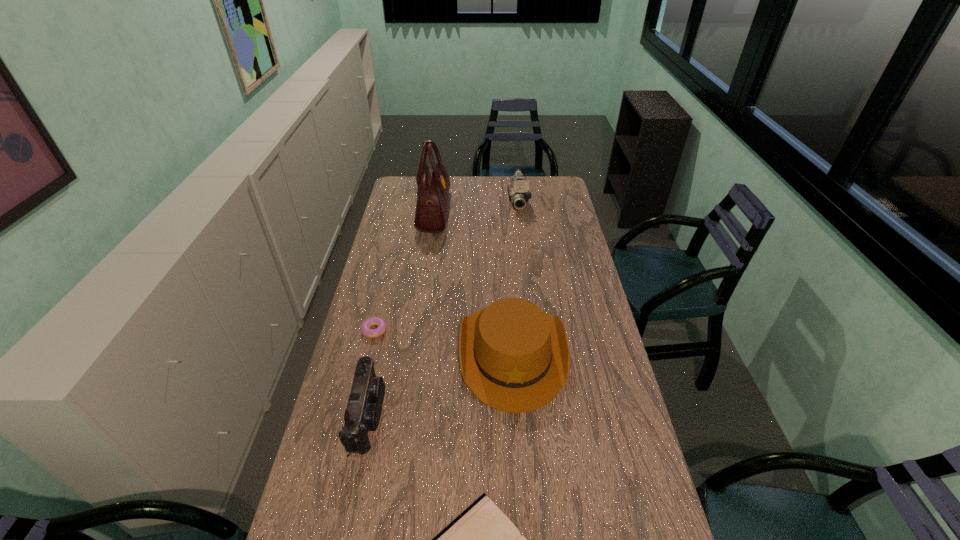
Identify which object is located as the fifth nearest to the nearer camcorder. Please provide its 2D coordinates. Your answer should be formatted as a tuple, i.e. [(x, y)], where the tuple contains the x and y coordinates of a point satisfying the conditions above.

[(518, 192)]

What are the coordinates of `object that is the fifth nearest to the handbag` in the screenshot? It's located at (482, 539).

Identify the location of free space that satisfies the following two spatial constraints: 1. on the front-facing side of the right camcorder; 2. on the front-facing side of the left camcorder. (546, 415).

The width and height of the screenshot is (960, 540). I want to click on vacant region that satisfies the following two spatial constraints: 1. on the front-facing side of the farther camcorder; 2. on the front-facing side of the nearer camcorder, so click(x=546, y=415).

This screenshot has height=540, width=960. I want to click on free region that satisfies the following two spatial constraints: 1. on the front-facing side of the cowboy hat; 2. on the front-facing side of the shorter camcorder, so click(516, 415).